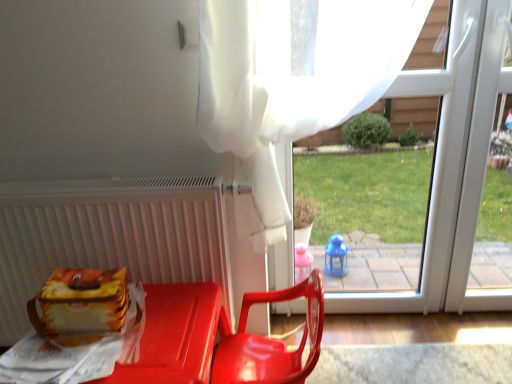
Question: From a real-world perspective, is transparent plastic window at center physically above glossy plastic chair at center?

Choices:
 (A) no
 (B) yes

Answer: (B)

Question: Could you tell me if transparent plastic window at center is turned towards glossy plastic chair at center?

Choices:
 (A) no
 (B) yes

Answer: (B)

Question: Is transparent plastic window at center located outside glossy plastic chair at center?

Choices:
 (A) no
 (B) yes

Answer: (B)

Question: From a real-world perspective, is transparent plastic window at center positioned under glossy plastic chair at center based on gravity?

Choices:
 (A) yes
 (B) no

Answer: (B)

Question: From the image's perspective, is transparent plastic window at center located beneath glossy plastic chair at center?

Choices:
 (A) no
 (B) yes

Answer: (A)

Question: From the image's perspective, relative to matte plastic lunch box at lower left, is glossy plastic chair at center above or below?

Choices:
 (A) below
 (B) above

Answer: (A)

Question: Visually, is glossy plastic chair at center positioned to the left or to the right of matte plastic lunch box at lower left?

Choices:
 (A) right
 (B) left

Answer: (A)

Question: Is glossy plastic chair at center spatially inside matte plastic lunch box at lower left, or outside of it?

Choices:
 (A) inside
 (B) outside

Answer: (B)

Question: Does point (298, 286) appear closer or farther from the camera than point (52, 279)?

Choices:
 (A) farther
 (B) closer

Answer: (A)

Question: In terms of width, does matte plastic lunch box at lower left look wider or thinner when compared to transparent plastic window at center?

Choices:
 (A) thin
 (B) wide

Answer: (B)

Question: Considering their positions, is matte plastic lunch box at lower left located in front of or behind transparent plastic window at center?

Choices:
 (A) behind
 (B) front

Answer: (B)

Question: Is matte plastic lunch box at lower left bigger or smaller than transparent plastic window at center?

Choices:
 (A) big
 (B) small

Answer: (B)

Question: From a real-world perspective, is matte plastic lunch box at lower left positioned above or below transparent plastic window at center?

Choices:
 (A) above
 (B) below

Answer: (B)

Question: Is white matte radiator at left situated inside glossy plastic chair at center or outside?

Choices:
 (A) inside
 (B) outside

Answer: (B)

Question: From a real-world perspective, is white matte radiator at left above or below glossy plastic chair at center?

Choices:
 (A) below
 (B) above

Answer: (B)